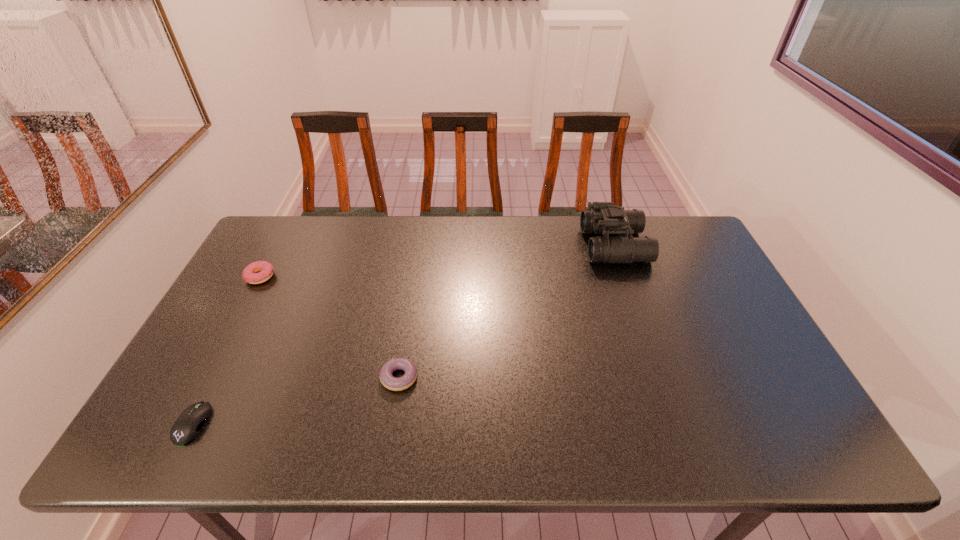
Locate an element on the screen. This screenshot has width=960, height=540. free space located on the right of the third object from left to right is located at coordinates (556, 377).

In order to click on vacant space located on the right of the nearest object in this screenshot , I will do `click(341, 423)`.

The image size is (960, 540). I want to click on object that is at the far edge, so click(605, 218).

Where is `object at the near edge`? The height and width of the screenshot is (540, 960). object at the near edge is located at coordinates (187, 426).

Where is `doughnut situated at the left edge`? The height and width of the screenshot is (540, 960). doughnut situated at the left edge is located at coordinates (265, 270).

Locate an element on the screen. The height and width of the screenshot is (540, 960). computer equipment that is at the left edge is located at coordinates [x=187, y=426].

This screenshot has width=960, height=540. In order to click on object that is at the near left corner in this screenshot , I will do `click(187, 426)`.

Identify the location of vacant space at the far edge. The height and width of the screenshot is (540, 960). (423, 215).

Identify the location of free space at the near edge of the desktop. The height and width of the screenshot is (540, 960). (324, 435).

Image resolution: width=960 pixels, height=540 pixels. I want to click on vacant space at the left edge, so click(238, 314).